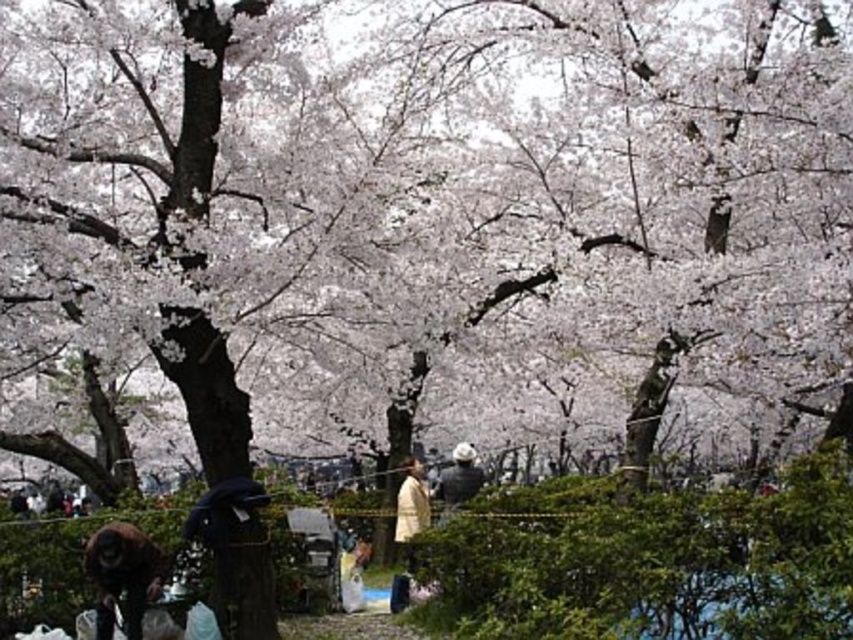
Measure the distance from brown fur monkey at lower left to light beige fabric coat at center.

brown fur monkey at lower left is 64.85 feet away from light beige fabric coat at center.

Looking at this image, does brown fur monkey at lower left appear over light beige fabric coat at center?

Yes.

Between point (96, 634) and point (410, 557), which one is positioned behind?

The point (410, 557) is more distant.

Image resolution: width=853 pixels, height=640 pixels. Identify the location of brown fur monkey at lower left. (122, 577).

Can you confirm if brown fur monkey at lower left is positioned below white matte jacket at center?

No.

Can you confirm if brown fur monkey at lower left is bigger than white matte jacket at center?

Incorrect, brown fur monkey at lower left is not larger than white matte jacket at center.

Is point (128, 600) farther from camera compared to point (479, 477)?

No.

This screenshot has width=853, height=640. What are the coordinates of `brown fur monkey at lower left` in the screenshot? It's located at (122, 577).

Is light beige fabric coat at center to the right of white matte jacket at center from the viewer's perspective?

In fact, light beige fabric coat at center is to the left of white matte jacket at center.

Is light beige fabric coat at center below white matte jacket at center?

Yes.

Describe the element at coordinates (410, 509) in the screenshot. I see `light beige fabric coat at center` at that location.

At what (x,y) coordinates should I click in order to perform the action: click on light beige fabric coat at center. Please return your answer as a coordinate pair (x, y). This screenshot has height=640, width=853. Looking at the image, I should click on (410, 509).